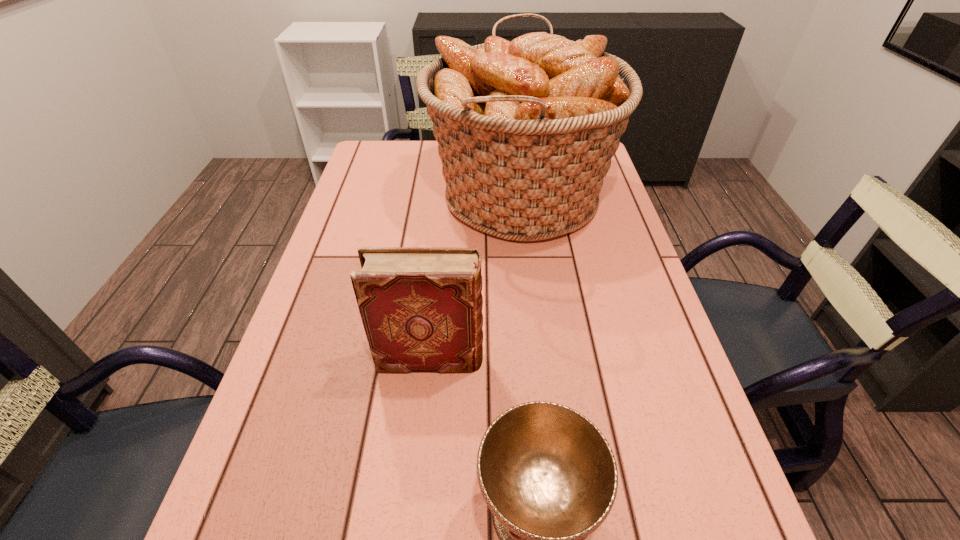
You are a GUI agent. You are given a task and a screenshot of the screen. Output one action in this format:
    pyautogui.click(x=<x>, y=<y>)
    Task: Click on the free space at the right edge
    
    Given the screenshot: What is the action you would take?
    pyautogui.click(x=579, y=267)

Image resolution: width=960 pixels, height=540 pixels. I want to click on vacant space at the far left corner, so click(x=360, y=178).

Select which object appears as the second closest to the tallest object. Please provide its 2D coordinates. Your answer should be formatted as a tuple, i.e. [(x, y)], where the tuple contains the x and y coordinates of a point satisfying the conditions above.

[(549, 476)]

At what (x,y) coordinates should I click in order to perform the action: click on object that stands as the second closest to the hardback book. Please return your answer as a coordinate pair (x, y). Image resolution: width=960 pixels, height=540 pixels. Looking at the image, I should click on (526, 130).